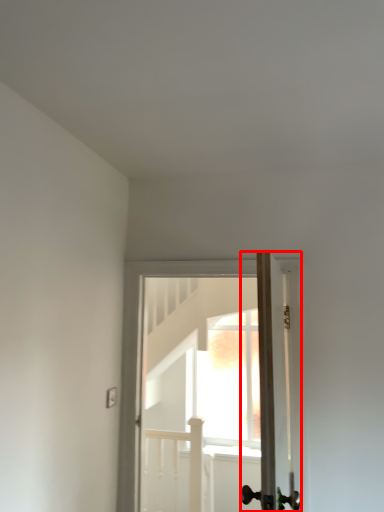
Question: From the image's perspective, where is door (annotated by the red box) located relative to door?

Choices:
 (A) above
 (B) below

Answer: (A)